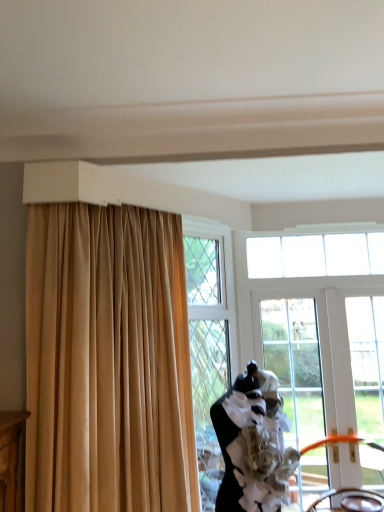
Question: Considering the relative positions of beige fabric curtain at upper left and clear glass window at upper center, arranged as the 1th window when viewed from the top, in the image provided, is beige fabric curtain at upper left behind clear glass window at upper center, arranged as the 1th window when viewed from the top,?

Choices:
 (A) yes
 (B) no

Answer: (B)

Question: From a real-world perspective, is beige fabric curtain at upper left on top of clear glass window at upper center, which appears as the second window when ordered from the bottom?

Choices:
 (A) no
 (B) yes

Answer: (A)

Question: Does beige fabric curtain at upper left have a smaller size compared to clear glass window at upper center, which appears as the second window when ordered from the bottom?

Choices:
 (A) yes
 (B) no

Answer: (B)

Question: Is beige fabric curtain at upper left shorter than clear glass window at upper center, arranged as the 1th window when viewed from the top?

Choices:
 (A) no
 (B) yes

Answer: (A)

Question: Can you confirm if beige fabric curtain at upper left is thinner than clear glass window at upper center, which appears as the second window when ordered from the bottom?

Choices:
 (A) no
 (B) yes

Answer: (A)

Question: In the image, is brown leather chair at lower right, the 2th chair in the back-to-front sequence, on the left side or the right side of white plastic door at right, which is the second window in top-to-bottom order?

Choices:
 (A) right
 (B) left

Answer: (B)

Question: Is brown leather chair at lower right, the first chair from the front, inside or outside of white plastic door at right, the first window in the bottom-to-top sequence?

Choices:
 (A) inside
 (B) outside

Answer: (B)

Question: Relative to white plastic door at right, which is the second window in top-to-bottom order, is brown leather chair at lower right, the first chair from the front, in front or behind?

Choices:
 (A) front
 (B) behind

Answer: (A)

Question: From a real-world perspective, is brown leather chair at lower right, the first chair from the front, physically located above or below white plastic door at right, the first window in the bottom-to-top sequence?

Choices:
 (A) above
 (B) below

Answer: (B)

Question: In terms of size, does black matte dress form at center appear bigger or smaller than beige fabric curtain at upper left?

Choices:
 (A) small
 (B) big

Answer: (A)

Question: Visually, is black matte dress form at center positioned to the left or to the right of beige fabric curtain at upper left?

Choices:
 (A) left
 (B) right

Answer: (B)

Question: Looking at their shapes, would you say black matte dress form at center is wider or thinner than beige fabric curtain at upper left?

Choices:
 (A) wide
 (B) thin

Answer: (A)

Question: Does point (248, 390) appear closer or farther from the camera than point (79, 361)?

Choices:
 (A) closer
 (B) farther

Answer: (B)

Question: From the image's perspective, is orange plastic chair at lower right, which ranks as the 2th chair in front-to-back order, above or below clear glass door at center?

Choices:
 (A) above
 (B) below

Answer: (B)

Question: Is point (334, 492) positioned closer to the camera than point (279, 373)?

Choices:
 (A) farther
 (B) closer

Answer: (B)